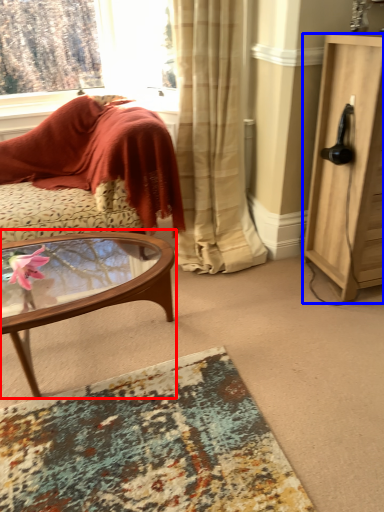
Question: Among these objects, which one is farthest to the camera, coffee table (highlighted by a red box) or cabinetry (highlighted by a blue box)?

Choices:
 (A) coffee table
 (B) cabinetry

Answer: (B)